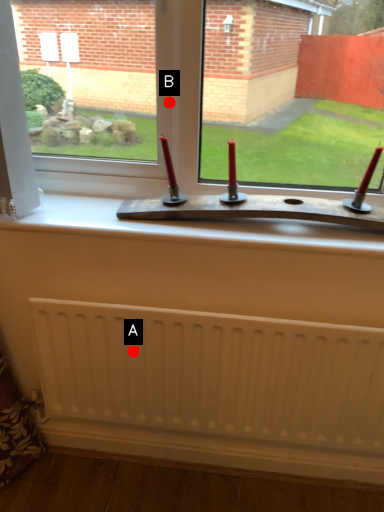
Question: Two points are circled on the image, labeled by A and B beside each circle. Which point is farther from the camera taking this photo?

Choices:
 (A) A is further
 (B) B is further

Answer: (A)